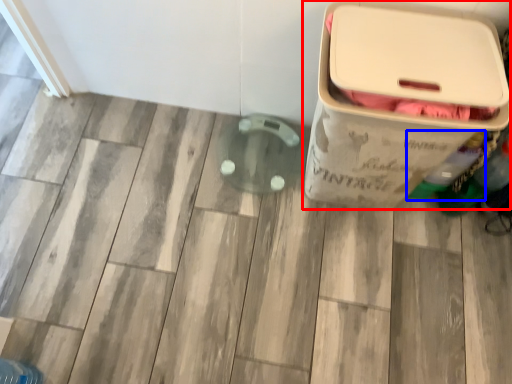
Question: Among these objects, which one is nearest to the camera, waste container (highlighted by a red box) or bottle (highlighted by a blue box)?

Choices:
 (A) waste container
 (B) bottle

Answer: (A)